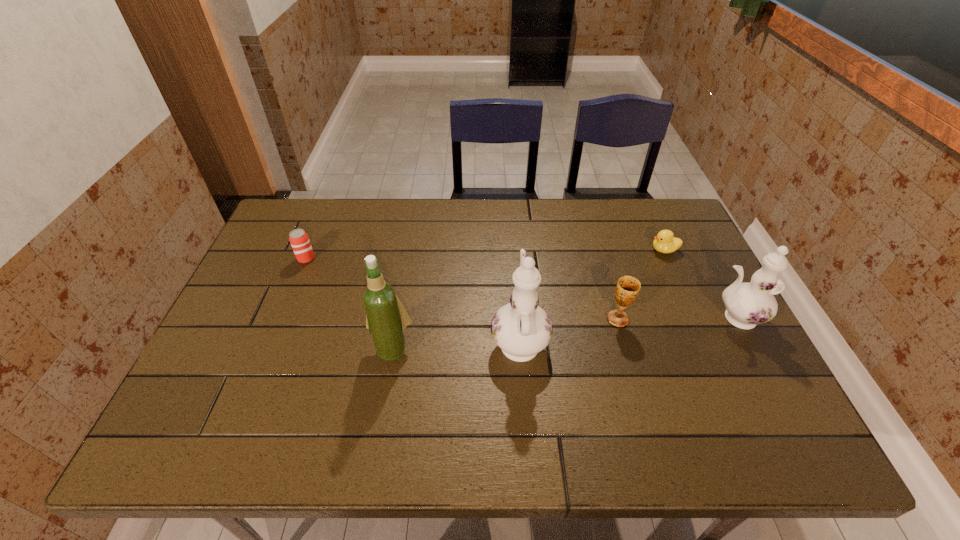
Locate an element on the screen. This screenshot has height=540, width=960. free space located at the spout of the taller chinaware is located at coordinates (511, 228).

You are a GUI agent. You are given a task and a screenshot of the screen. Output one action in this format:
    pyautogui.click(x=<x>, y=<y>)
    Task: Click on the vacant area located at the spout of the taller chinaware
    Image resolution: width=960 pixels, height=540 pixels.
    Given the screenshot: What is the action you would take?
    pyautogui.click(x=510, y=220)

You are a GUI agent. You are given a task and a screenshot of the screen. Output one action in this format:
    pyautogui.click(x=<x>, y=<y>)
    Task: Click on the vacant area situated 0.330m at the spout of the taller chinaware
    This screenshot has height=540, width=960.
    Given the screenshot: What is the action you would take?
    pyautogui.click(x=511, y=234)

In order to click on free space located 0.240m at the spout of the right chinaware in this screenshot , I will do `click(614, 318)`.

I want to click on free space located 0.170m at the spout of the right chinaware, so click(641, 318).

You are a GUI agent. You are given a task and a screenshot of the screen. Output one action in this format:
    pyautogui.click(x=<x>, y=<y>)
    Task: Click on the free region located 0.150m at the spout of the right chinaware
    The height and width of the screenshot is (540, 960).
    Given the screenshot: What is the action you would take?
    pyautogui.click(x=649, y=318)

You are a GUI agent. You are given a task and a screenshot of the screen. Output one action in this format:
    pyautogui.click(x=<x>, y=<y>)
    Task: Click on the free region located 0.310m on the beak of the shortest object
    
    Given the screenshot: What is the action you would take?
    pyautogui.click(x=549, y=250)

Find the location of `free point located 0.330m on the beak of the shortest object`. free point located 0.330m on the beak of the shortest object is located at coordinates (543, 250).

What are the coordinates of `free space located 0.250m on the beak of the shortest object` in the screenshot? It's located at (569, 250).

I want to click on vacant area situated on the front-facing side of the wine bottle, so (381, 410).